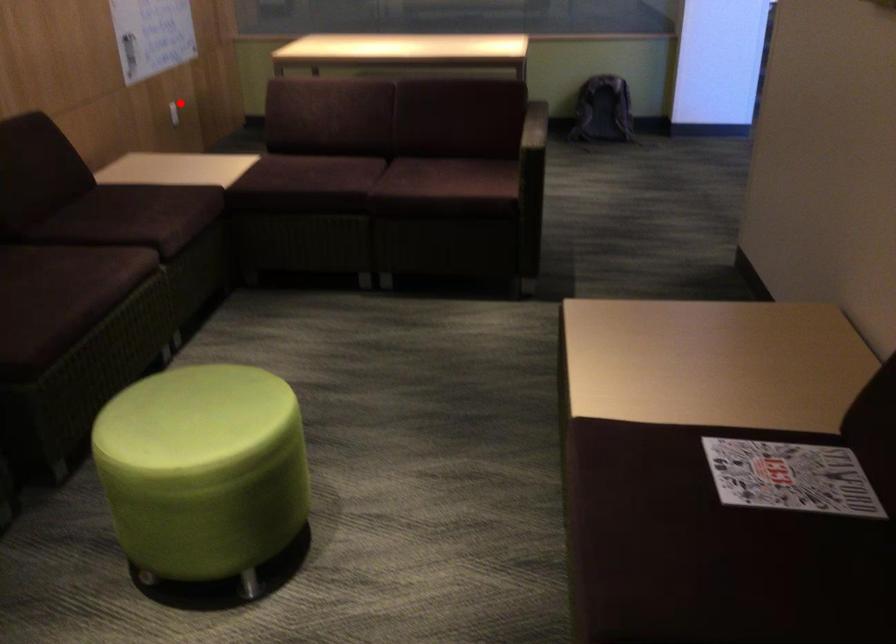
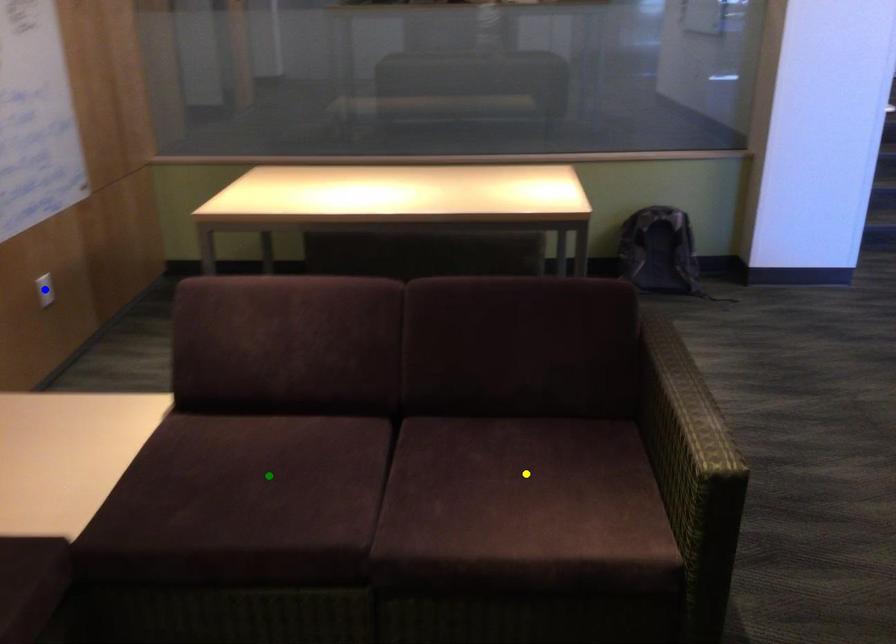
Question: I am providing you with two images of the same scene from different viewpoints. A red point is marked on the first image. You are given multiple points on the second image. Can you choose the point in image 2 that corresponds to the point in image 1?

Choices:
 (A) green point
 (B) blue point
 (C) yellow point

Answer: (B)